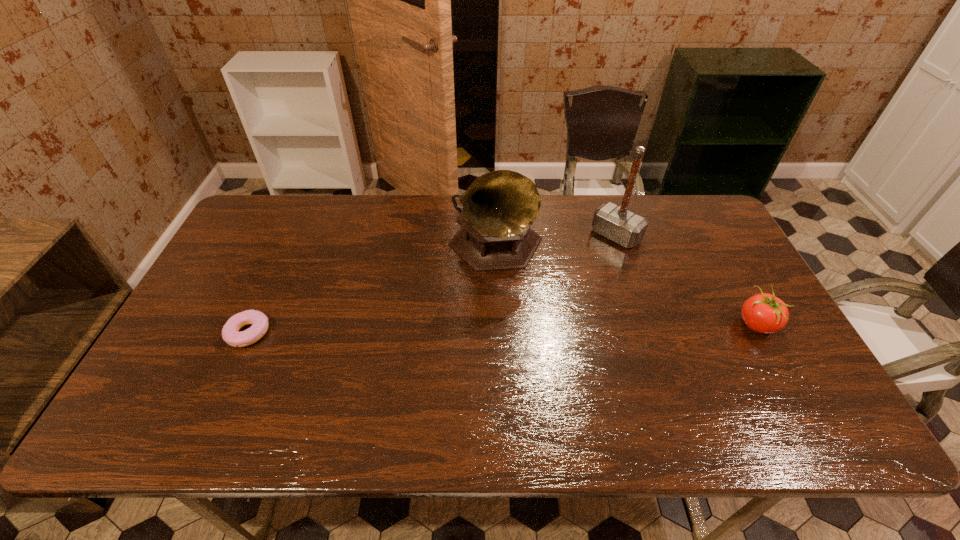
The height and width of the screenshot is (540, 960). What are the coordinates of `blank region between the rightmost object and the second object from left to right` in the screenshot? It's located at (626, 288).

Identify the location of free point between the second shortest object and the leftmost object. This screenshot has width=960, height=540. (502, 329).

This screenshot has width=960, height=540. I want to click on free space between the shortest object and the second shortest object, so click(502, 329).

The width and height of the screenshot is (960, 540). Identify the location of free space between the shortest object and the rightmost object. coord(502,329).

Select which object appears as the third closest to the third tallest object. Please provide its 2D coordinates. Your answer should be formatted as a tuple, i.e. [(x, y)], where the tuple contains the x and y coordinates of a point satisfying the conditions above.

[(259, 321)]

Where is `object that is the third closest one to the hammer`? The height and width of the screenshot is (540, 960). object that is the third closest one to the hammer is located at coordinates (259, 321).

Locate an element on the screen. This screenshot has width=960, height=540. blank space that satisfies the following two spatial constraints: 1. on the back side of the shortest object; 2. on the left side of the third object from right to left is located at coordinates (286, 251).

Locate an element on the screen. This screenshot has height=540, width=960. free location that satisfies the following two spatial constraints: 1. on the front side of the tomato; 2. on the left side of the second object from left to right is located at coordinates (498, 325).